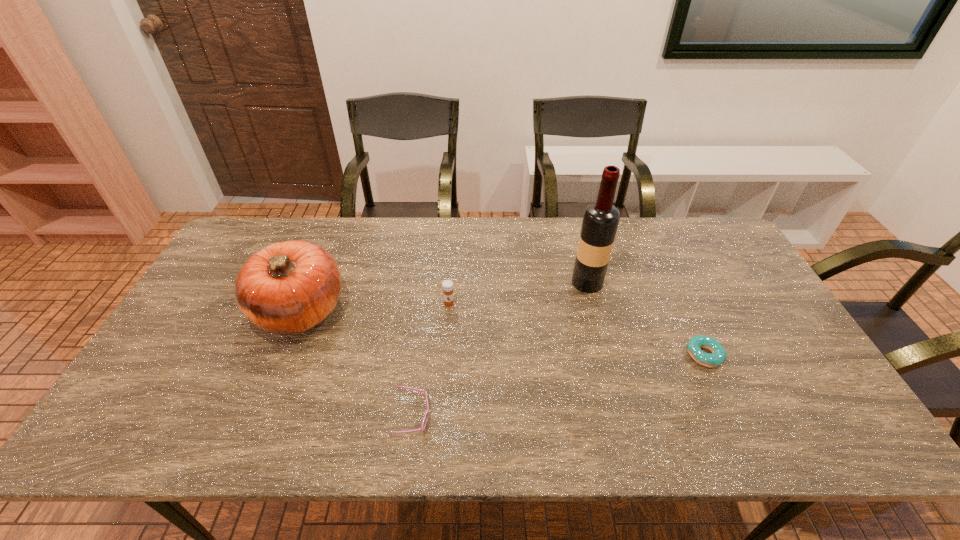
I want to click on free space at the near left corner, so pos(138,431).

Identify the location of vacant space at the far right corner of the desktop. (722, 255).

Where is `vacant space at the near right corner of the desktop`? vacant space at the near right corner of the desktop is located at coordinates (785, 421).

The image size is (960, 540). Identify the location of free space between the shortest object and the fourth shortest object. (502, 333).

The width and height of the screenshot is (960, 540). I want to click on vacant area that lies between the doughnut and the sunglasses, so click(x=559, y=387).

The image size is (960, 540). I want to click on free space that is in between the sunglasses and the pumpkin, so click(x=356, y=364).

You are a GUI agent. You are given a task and a screenshot of the screen. Output one action in this format:
    pyautogui.click(x=<x>, y=<y>)
    Task: Click on the vacant region between the nearest object and the pumpkin
    The image size is (960, 540).
    Given the screenshot: What is the action you would take?
    pyautogui.click(x=356, y=364)

Locate an element on the screen. empty space that is in between the sunglasses and the wine bottle is located at coordinates (500, 350).

I want to click on vacant area between the third object from right to left and the leftmost object, so point(374,307).

What are the coordinates of `free spot between the shortest object and the second object from left to right` in the screenshot? It's located at (559, 387).